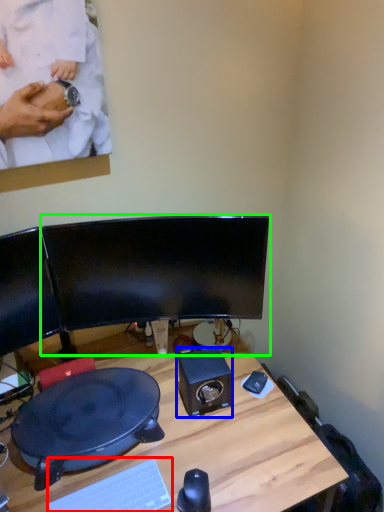
Question: Based on their relative distances, which object is farther from computer keyboard (highlighted by a red box)? Choose from speaker (highlighted by a blue box) and computer monitor (highlighted by a green box).

Choices:
 (A) speaker
 (B) computer monitor

Answer: (B)